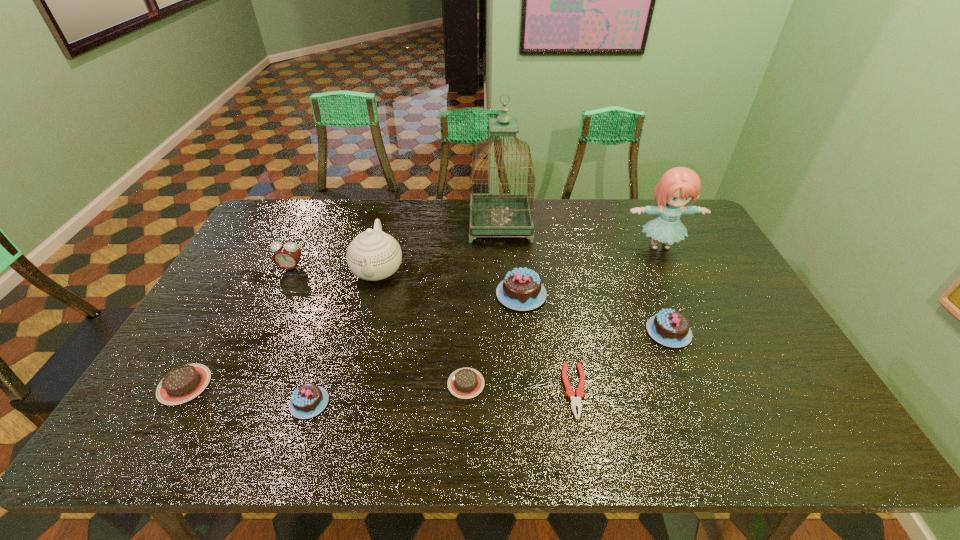
Locate an element on the screen. vacant space located 0.070m at the door of the greenish birdcage is located at coordinates (450, 225).

Locate an element on the screen. This screenshot has width=960, height=540. free space located 0.080m at the door of the greenish birdcage is located at coordinates (447, 225).

Image resolution: width=960 pixels, height=540 pixels. What are the coordinates of `free location located 0.290m on the front-facing side of the doll` in the screenshot? It's located at (699, 327).

At what (x,y) coordinates should I click in order to perform the action: click on vacant area situated 0.200m on the spout of the chinaware. Please return your answer as a coordinate pair (x, y). This screenshot has height=540, width=960. Looking at the image, I should click on (357, 349).

The height and width of the screenshot is (540, 960). In order to click on vacant space situated 0.160m on the clock face of the pink alarm clock in this screenshot , I will do `click(272, 309)`.

At what (x,y) coordinates should I click in order to perform the action: click on free region located 0.370m on the back of the second pink chocolate cake from left to right. Please return your answer as a coordinate pair (x, y). The image size is (960, 540). Looking at the image, I should click on (513, 211).

You are a GUI agent. You are given a task and a screenshot of the screen. Output one action in this format:
    pyautogui.click(x=<x>, y=<y>)
    Task: Click on the free space located on the left of the sixth farthest object
    
    Given the screenshot: What is the action you would take?
    pyautogui.click(x=518, y=332)

Identify the location of free space located 0.240m on the back of the seventh tallest object. This screenshot has width=960, height=540. (338, 315).

The width and height of the screenshot is (960, 540). What are the coordinates of `vacant space situated on the back of the left brown chocolate cake` in the screenshot? It's located at (230, 306).

At what (x,y) coordinates should I click in order to perform the action: click on vacant space located 0.100m on the right of the ninth tallest object. Please return your answer as a coordinate pair (x, y). This screenshot has height=540, width=960. Looking at the image, I should click on (525, 383).